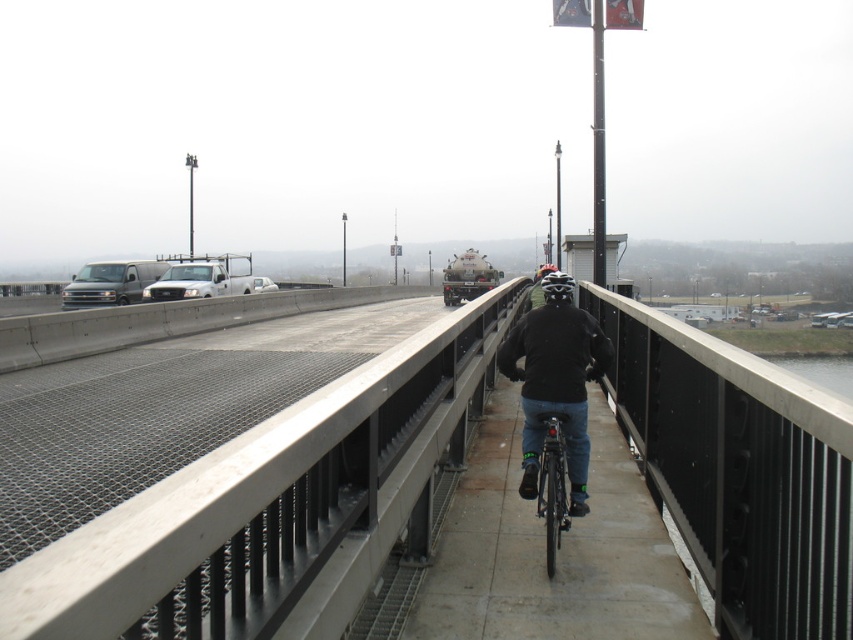
Which is more to the left, smooth concrete bridge at center or dark blue jeans at center?

dark blue jeans at center is more to the left.

Is smooth concrete bridge at center thinner than dark blue jeans at center?

Indeed, smooth concrete bridge at center has a lesser width compared to dark blue jeans at center.

Who is more forward, (697, 461) or (607, 365)?

Positioned in front is point (697, 461).

Locate an element on the screen. smooth concrete bridge at center is located at coordinates (270, 508).

Locate an element on the screen. The width and height of the screenshot is (853, 640). dark blue jeans at center is located at coordinates click(x=555, y=380).

Is dark blue jeans at center closer to the viewer compared to shiny metallic bicycle at center?

No, it is not.

Describe the element at coordinates (555, 380) in the screenshot. I see `dark blue jeans at center` at that location.

You are a GUI agent. You are given a task and a screenshot of the screen. Output one action in this format:
    pyautogui.click(x=<x>, y=<y>)
    Task: Click on the dark blue jeans at center
    The height and width of the screenshot is (640, 853).
    Given the screenshot: What is the action you would take?
    pyautogui.click(x=555, y=380)

Between smooth concrete bridge at center and shiny metallic bicycle at center, which one appears on the right side from the viewer's perspective?

smooth concrete bridge at center

Does smooth concrete bridge at center appear on the left side of shiny metallic bicycle at center?

No, smooth concrete bridge at center is not to the left of shiny metallic bicycle at center.

Which is in front, point (99, 573) or point (556, 550)?

Point (99, 573)

The image size is (853, 640). Find the location of `smooth concrete bridge at center`. smooth concrete bridge at center is located at coordinates (270, 508).